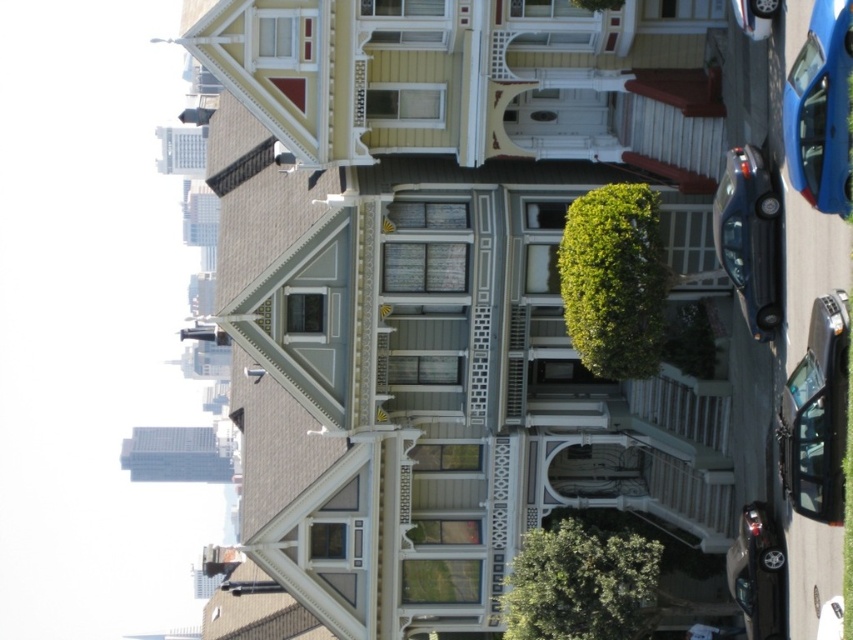
Can you confirm if metallic blue car at right is positioned to the right of shiny black sedan at lower right?

No, metallic blue car at right is not to the right of shiny black sedan at lower right.

Can you confirm if metallic blue car at right is bigger than shiny black sedan at lower right?

Incorrect, metallic blue car at right is not larger than shiny black sedan at lower right.

Who is more forward, (817, 131) or (732, 576)?

Point (817, 131) is in front.

This screenshot has height=640, width=853. I want to click on metallic blue car at right, so click(820, 109).

Which is in front, point (828, 385) or point (738, 532)?

Point (828, 385) is in front.

This screenshot has width=853, height=640. Find the location of `shiny black car at lower right`. shiny black car at lower right is located at coordinates (816, 416).

Which is more to the right, shiny black car at lower right or metallic blue sedan at right?

Positioned to the right is shiny black car at lower right.

Is point (827, 404) positioned before point (761, 276)?

Yes, it is in front of point (761, 276).

Locate an element on the screen. The width and height of the screenshot is (853, 640). shiny black car at lower right is located at coordinates (816, 416).